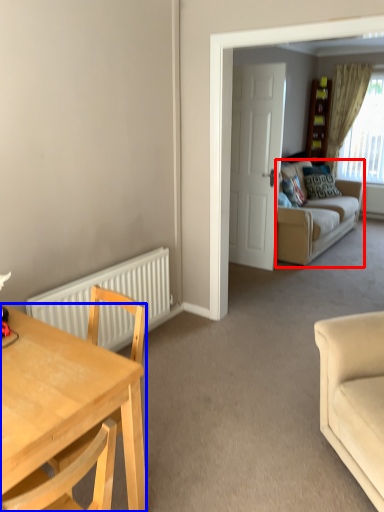
Question: Which of the following is the closest to the observer, studio couch (highlighted by a red box) or desk (highlighted by a blue box)?

Choices:
 (A) studio couch
 (B) desk

Answer: (B)